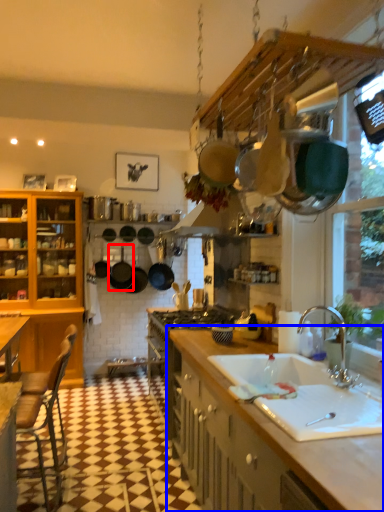
Question: Which of the following is the farthest to the observer, frying pan (highlighted by a red box) or countertop (highlighted by a blue box)?

Choices:
 (A) frying pan
 (B) countertop

Answer: (A)